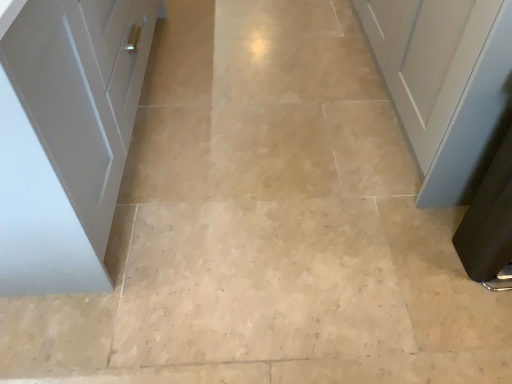
Describe the element at coordinates (66, 136) in the screenshot. I see `white matte cabinet at left` at that location.

Locate an element on the screen. white matte cabinet at left is located at coordinates (66, 136).

In order to face white matte cabinet at left, should I rotate leftwards or rightwards?

You should look left and rotate roughly 31.303 degrees.

Locate an element on the screen. The width and height of the screenshot is (512, 384). white matte cabinet at left is located at coordinates (66, 136).